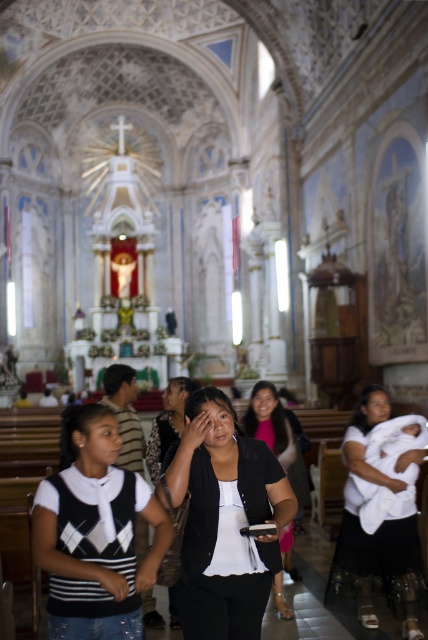
You are a photographer standing at the entrance of the church. You want to capture a photo that includes both the white knit sweater at center and the matte black shirt at center. The camera you are using has a maximum focus range of 4 meters. Will you be able to capture both subjects in focus without moving closer?

The distance between the white knit sweater at center and the matte black shirt at center is 4.22 meters. Since your camera can only focus up to 4 meters, you will not be able to capture both subjects in focus without moving closer.

You are standing in the grand church and want to take a photo of the black matte shirt at center. Your camera is 18.90 meters away from the shirt. Is the camera close enough to capture the shirt clearly without zooming?

The black matte shirt at center and camera are 18.90 meters apart. The camera may not be close enough to capture the shirt clearly without zooming, as the distance is quite significant.